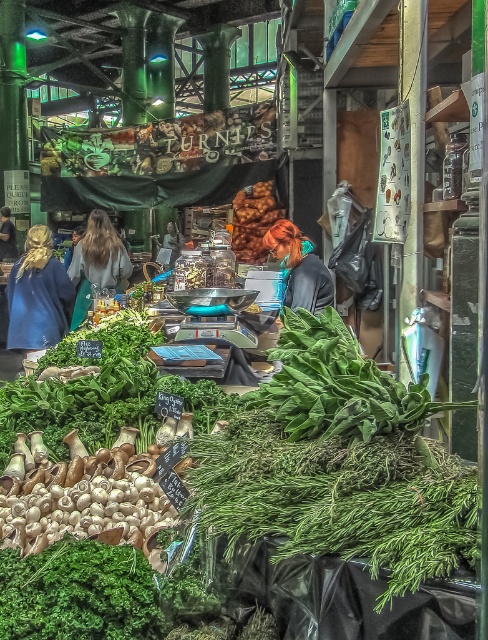
You are standing in the market and want to reach the vendor at point (65,262). There is an obstacle at point (114,232). Will you encounter the obstacle before reaching the vendor?

Yes, you will encounter the obstacle at point (114,232) before reaching the vendor at point (65,262) because point (114,232) is closer to the viewer.